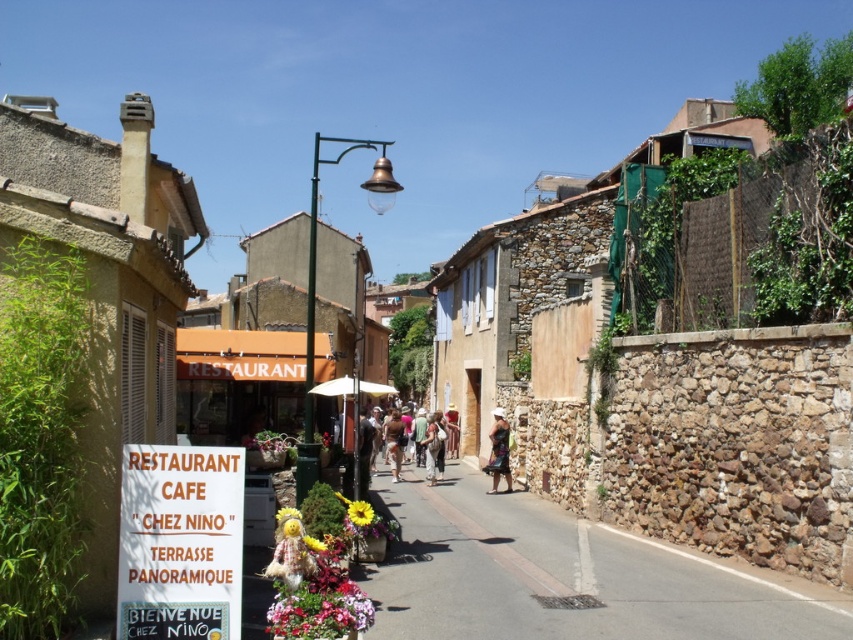
You are standing on the street in front of the restaurant. You need to read the white paper sign at center. Can you reach it without moving closer?

The white paper sign at center is 8.43 meters from viewer, so you cannot reach it without moving closer.

Looking at this image, you are standing on the street in front of Chez Nino restaurant. You notice two points marked in the scene. The first point is at coordinate (230, 540) and the second is at (399, 440). If you were to walk towards both points, which one would you reach first?

The point at coordinate (230, 540) is closer to the camera than the point at (399, 440), so you would reach it first.

You are a painter standing in the street scene. You want to paint the smooth stone wall at center and the tan fabric dress at center. Which object should you look upwards to paint?

The smooth stone wall at center is above the tan fabric dress at center, so you should look upwards to paint the smooth stone wall at center.